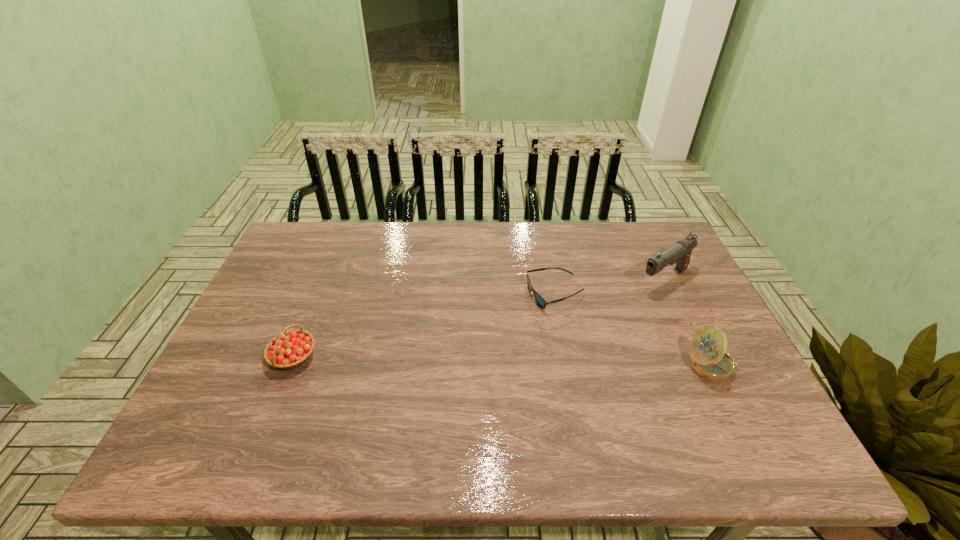
This screenshot has height=540, width=960. In order to click on free spot between the gun and the compass in this screenshot , I will do `click(688, 323)`.

In order to click on free spot between the second shortest object and the third shortest object in this screenshot , I will do `click(503, 361)`.

Find the location of a particular element. The image size is (960, 540). free space between the second tallest object and the strawberry is located at coordinates [503, 361].

Identify the location of object that is the second closest to the strawberry. (680, 253).

The image size is (960, 540). I want to click on object that is the third closest one to the gun, so click(x=290, y=349).

The height and width of the screenshot is (540, 960). I want to click on vacant area that satisfies the following two spatial constraints: 1. on the front side of the compass; 2. with the dial facing the leftmost object, so click(x=290, y=366).

Where is `vacant space that satisfies the following two spatial constraints: 1. on the front side of the gun; 2. with the dial facing the third shortest object`? vacant space that satisfies the following two spatial constraints: 1. on the front side of the gun; 2. with the dial facing the third shortest object is located at coordinates (705, 366).

Identify the location of free location that satisfies the following two spatial constraints: 1. on the front side of the third tallest object; 2. with the dial facing the compass. The width and height of the screenshot is (960, 540). (290, 366).

The width and height of the screenshot is (960, 540). Identify the location of free region that satisfies the following two spatial constraints: 1. on the front side of the sunglasses; 2. with the dial facing the compass. (568, 366).

Identify the location of free location that satisfies the following two spatial constraints: 1. on the front side of the compass; 2. with the dial facing the second shortest object. (290, 366).